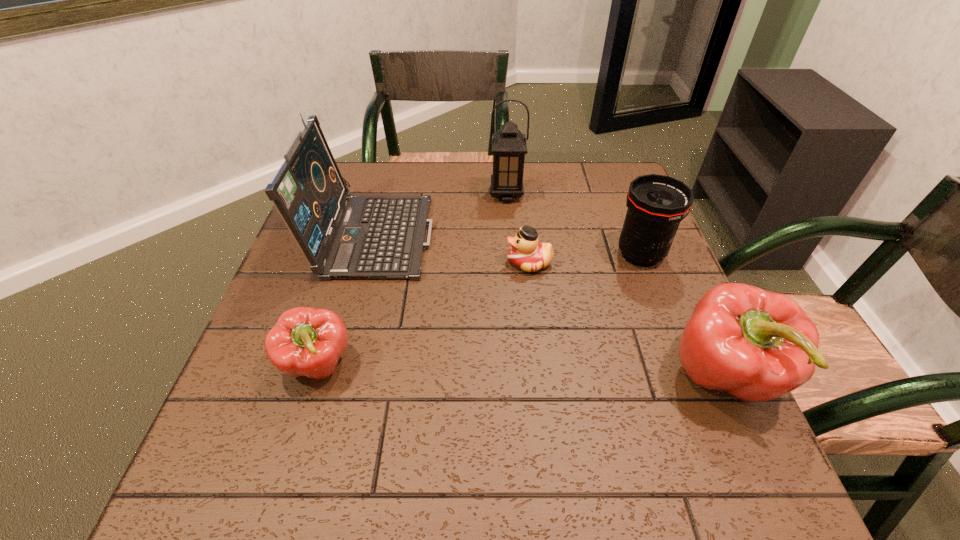
This screenshot has width=960, height=540. I want to click on free space located on the face of the shortest object, so coord(349,262).

At what (x,y) coordinates should I click in order to perform the action: click on free region located on the face of the shortest object. Please return your answer as a coordinate pair (x, y). This screenshot has width=960, height=540. Looking at the image, I should click on (416, 262).

You are a GUI agent. You are given a task and a screenshot of the screen. Output one action in this format:
    pyautogui.click(x=<x>, y=<y>)
    Task: Click on the free space located 0.050m on the front-facing side of the laptop computer
    This screenshot has width=960, height=540.
    Given the screenshot: What is the action you would take?
    pyautogui.click(x=451, y=233)

Find the location of a particular element. free spot located on the left of the telephoto lens is located at coordinates (532, 254).

Locate an element on the screen. This screenshot has height=540, width=960. vacant space situated on the front of the lantern is located at coordinates (511, 247).

Where is `laptop computer at the far edge`? The height and width of the screenshot is (540, 960). laptop computer at the far edge is located at coordinates (362, 237).

Find the location of a particular element. lantern positioned at the far edge is located at coordinates (509, 147).

The width and height of the screenshot is (960, 540). Identify the location of pepper that is at the left edge. (305, 341).

I want to click on laptop computer at the left edge, so click(362, 237).

Image resolution: width=960 pixels, height=540 pixels. Identify the location of pepper located in the right edge section of the desktop. (757, 345).